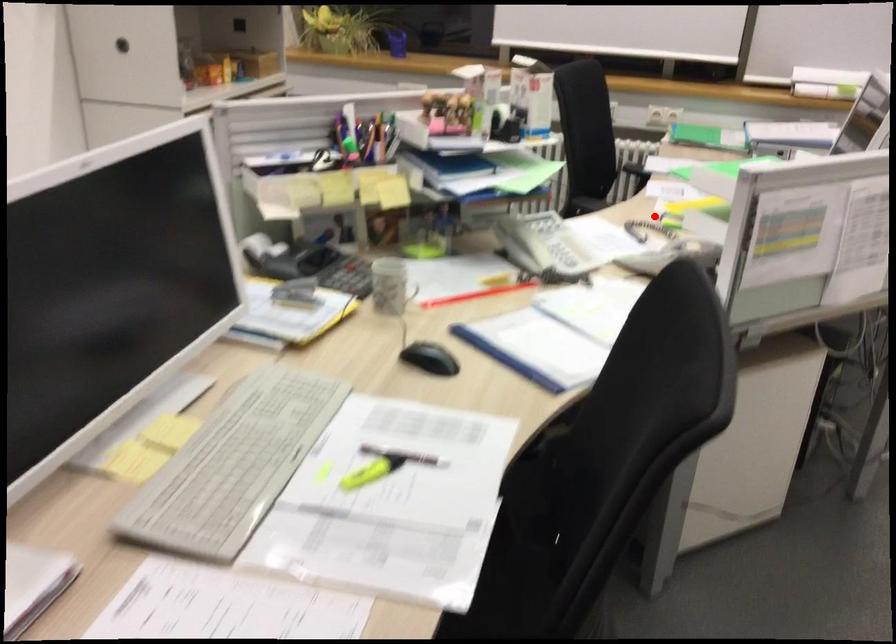
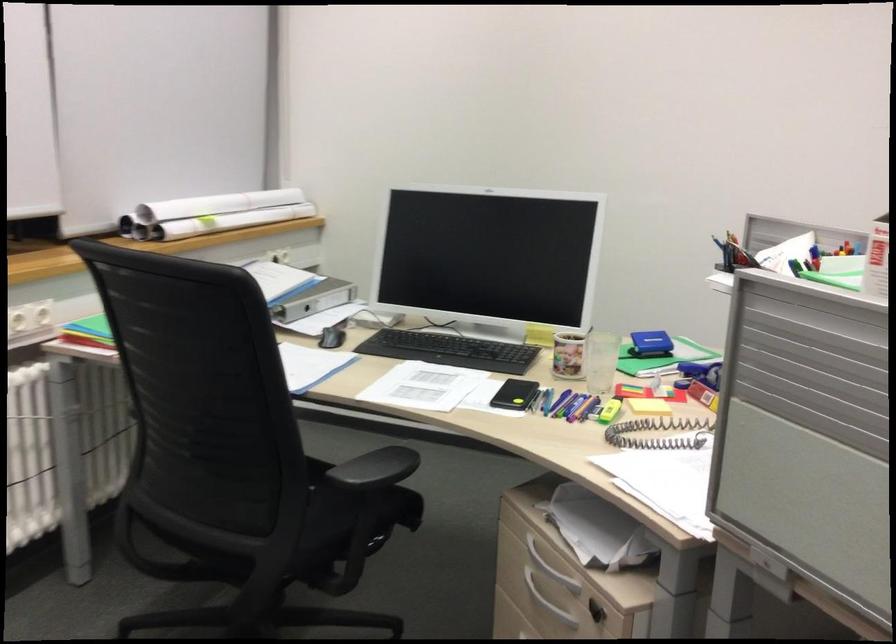
Question: I am providing you with two images of the same scene from different viewpoints. Image1 has a red point marked. In image2, the corresponding 3D location appears at what relative position? Reply with the corresponding letter.

Choices:
 (A) Closer
 (B) Farther

Answer: (A)